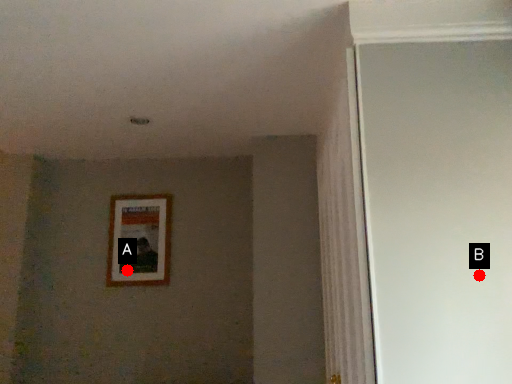
Question: Two points are circled on the image, labeled by A and B beside each circle. Among these points, which one is nearest to the camera?

Choices:
 (A) A is closer
 (B) B is closer

Answer: (B)